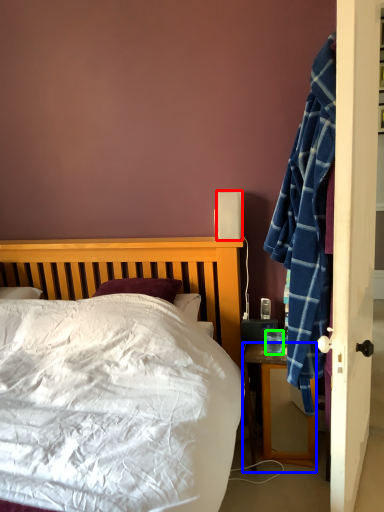
Question: Which is nearer to the loudspeaker (highlighted by a red box)? desk (highlighted by a blue box) or coffee cup (highlighted by a green box).

Choices:
 (A) desk
 (B) coffee cup

Answer: (B)